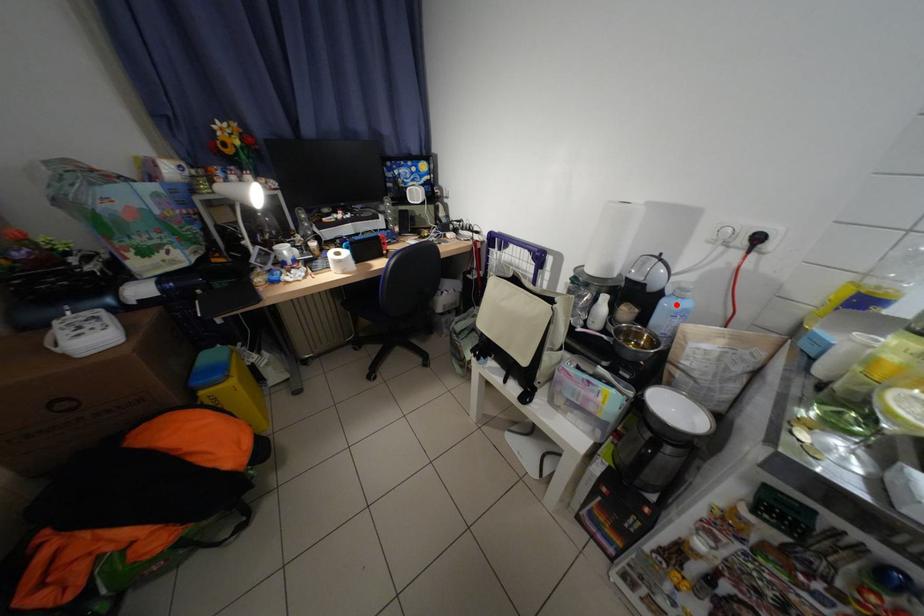
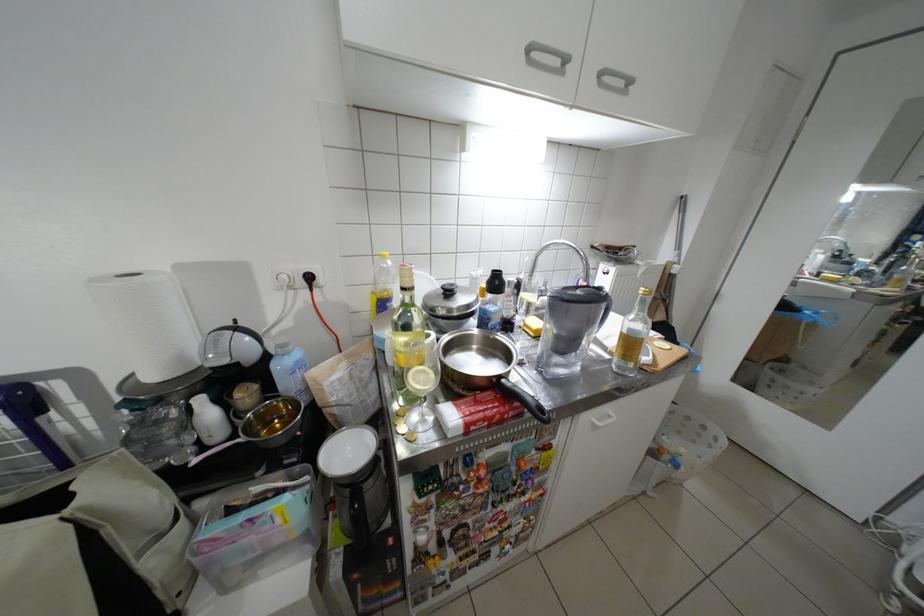
Locate, in the second image, the point that corresponds to the highlighted location in the first image.

(287, 367)